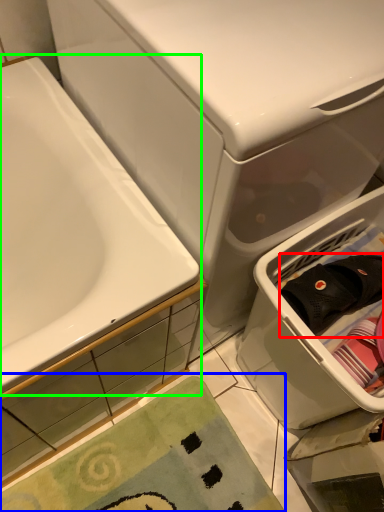
Question: Which object is the closest to the clothing (highlighted by a red box)? Choose among these: bath mat (highlighted by a blue box) or bathtub (highlighted by a green box).

Choices:
 (A) bath mat
 (B) bathtub

Answer: (B)